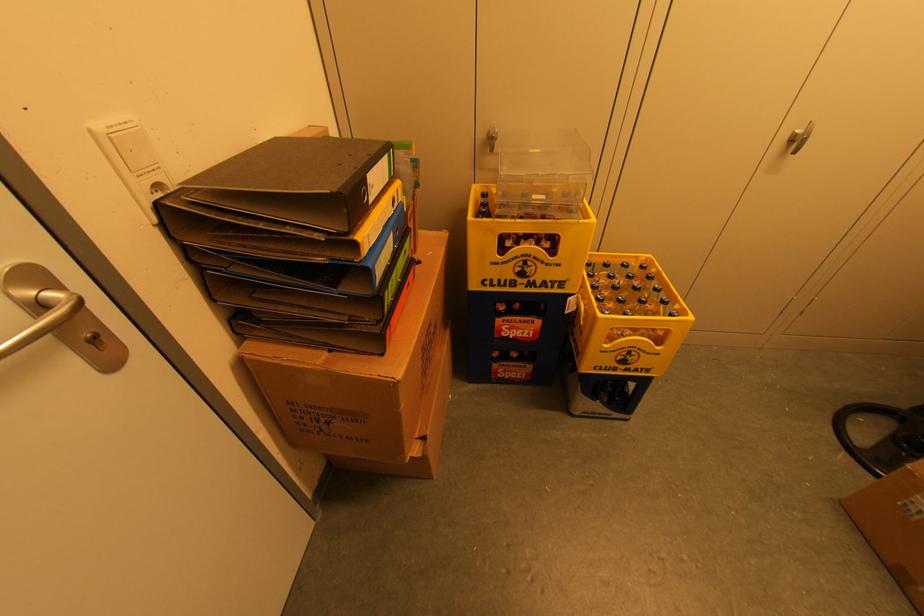
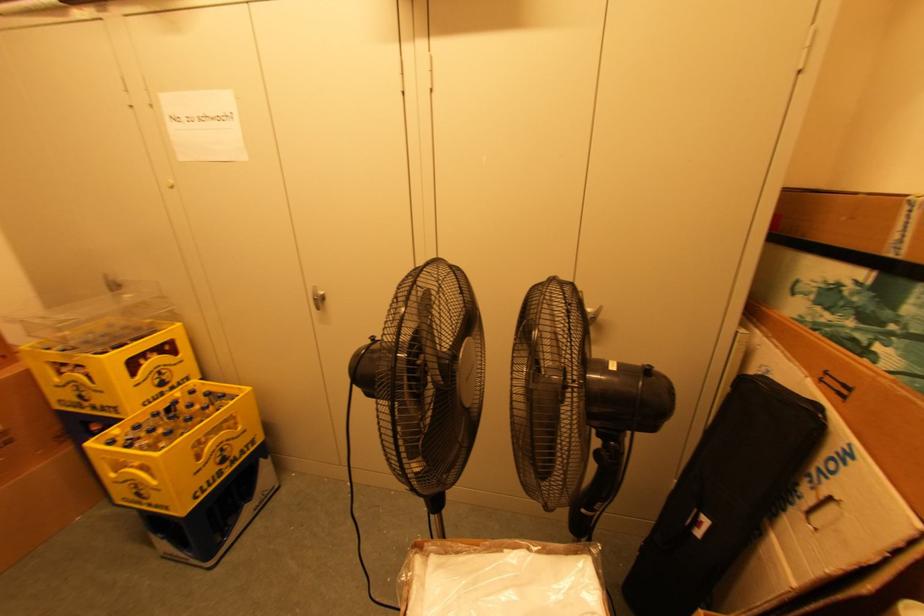
Question: The images are taken continuously from a first-person perspective. In which direction are you moving?

Choices:
 (A) Left
 (B) Right
 (C) Forward
 (D) Backward

Answer: (B)